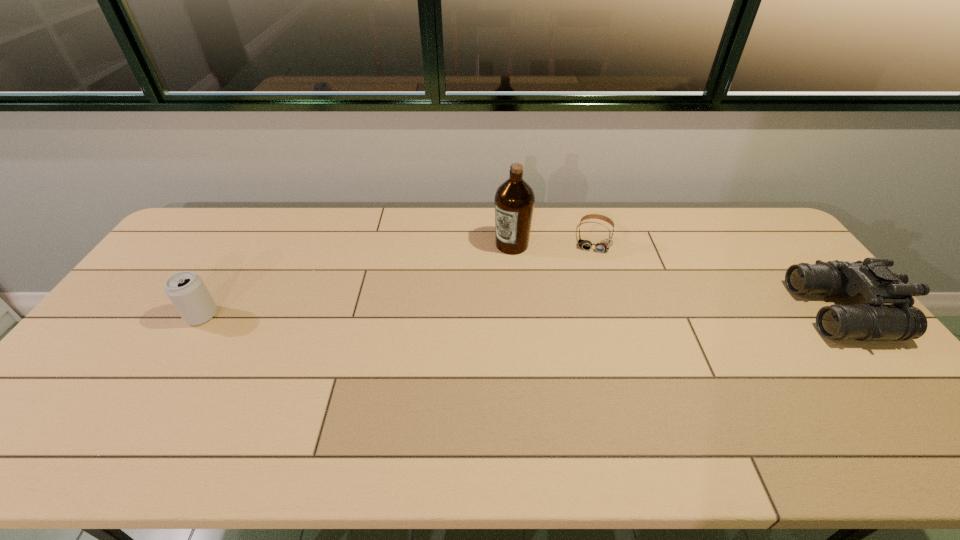
The width and height of the screenshot is (960, 540). Find the location of `free space that is in between the leftmost object and the shortest object`. free space that is in between the leftmost object and the shortest object is located at coordinates (398, 276).

I want to click on vacant area that lies between the can and the binoculars, so pos(521,314).

Identify the location of free point between the leftmost object and the goggles. The height and width of the screenshot is (540, 960). (398, 276).

Where is `object that is the third closest to the binoculars`? object that is the third closest to the binoculars is located at coordinates (186, 290).

Locate which object is the closest to the can. Please provide its 2D coordinates. Your answer should be formatted as a tuple, i.e. [(x, y)], where the tuple contains the x and y coordinates of a point satisfying the conditions above.

[(514, 200)]

I want to click on free space that satisfies the following two spatial constraints: 1. on the back side of the can; 2. through the lenses of the binoculars, so click(204, 312).